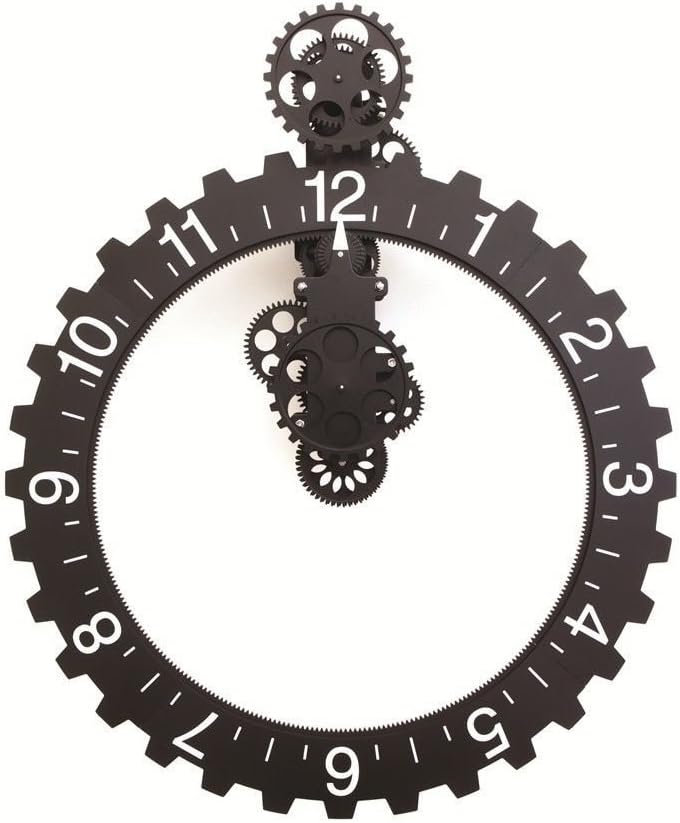
What are the coordinates of `background top left of clock` in the screenshot? It's located at (63, 198).